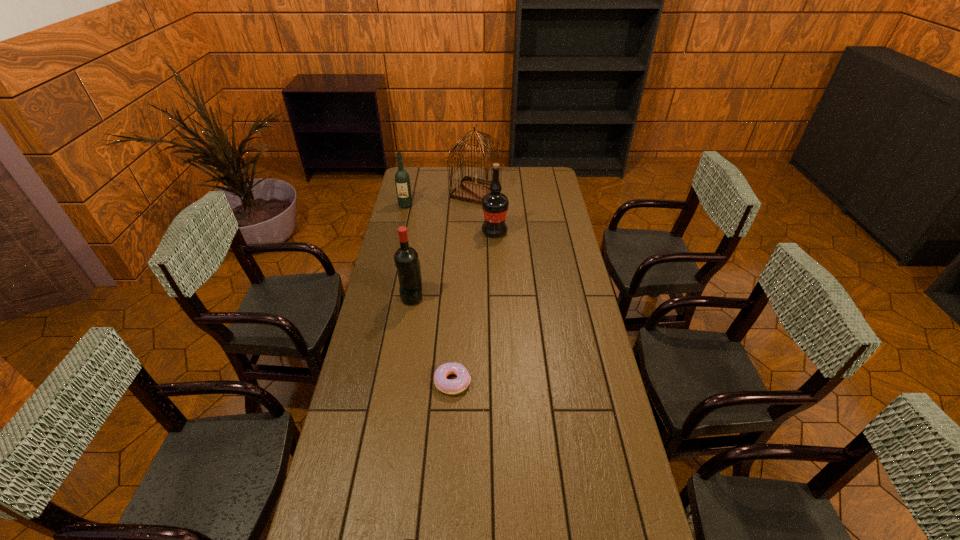
What are the coordinates of `vacant area in the image that satisfies the following two spatial constraints: 1. on the labeled side of the shortest object; 2. on the left side of the farthest wine bottle` in the screenshot? It's located at (366, 382).

Where is `vacant area in the image that satisfies the following two spatial constraints: 1. on the labeled side of the farthest wine bottle; 2. on the left side of the shortest object`? The width and height of the screenshot is (960, 540). vacant area in the image that satisfies the following two spatial constraints: 1. on the labeled side of the farthest wine bottle; 2. on the left side of the shortest object is located at coordinates (366, 382).